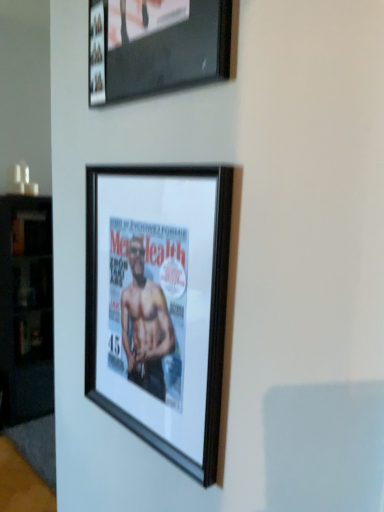
Describe the element at coordinates (156, 46) in the screenshot. Image resolution: width=384 pixels, height=512 pixels. I see `matte black picture frame at upper center, the second picture frame when ordered from bottom to top` at that location.

I want to click on black matte picture frame at center, which appears as the first picture frame when ordered from the bottom, so click(159, 304).

Which point is more distant from viewer, (159, 320) or (213, 59)?

Positioned behind is point (159, 320).

Between black matte picture frame at center, the 2th picture frame when ordered from top to bottom, and matte black picture frame at upper center, which appears as the first picture frame when viewed from the top, which one has smaller width?

With smaller width is black matte picture frame at center, the 2th picture frame when ordered from top to bottom.

Is black matte picture frame at center, the 2th picture frame when ordered from top to bottom, to the left or to the right of matte black picture frame at upper center, the second picture frame when ordered from bottom to top, in the image?

black matte picture frame at center, the 2th picture frame when ordered from top to bottom, is positioned on matte black picture frame at upper center, the second picture frame when ordered from bottom to top,'s left side.

Based on the photo, considering the sizes of black matte picture frame at center, the 2th picture frame when ordered from top to bottom, and matte black picture frame at upper center, the second picture frame when ordered from bottom to top, in the image, is black matte picture frame at center, the 2th picture frame when ordered from top to bottom, bigger or smaller than matte black picture frame at upper center, the second picture frame when ordered from bottom to top,?

black matte picture frame at center, the 2th picture frame when ordered from top to bottom, is smaller than matte black picture frame at upper center, the second picture frame when ordered from bottom to top.

Where is `cabinetry below the black matte picture frame at center, which appears as the first picture frame when ordered from the bottom (from the image's perspective)`? The height and width of the screenshot is (512, 384). cabinetry below the black matte picture frame at center, which appears as the first picture frame when ordered from the bottom (from the image's perspective) is located at coordinates (26, 308).

Which object is further away from the camera, black matte picture frame at center, which appears as the first picture frame when ordered from the bottom, or black wood cabinet at left?

Positioned behind is black wood cabinet at left.

Is black matte picture frame at center, the 2th picture frame when ordered from top to bottom, looking in the opposite direction of black wood cabinet at left?

No.

Considering the relative positions of black matte picture frame at center, which appears as the first picture frame when ordered from the bottom, and black wood cabinet at left in the image provided, is black matte picture frame at center, which appears as the first picture frame when ordered from the bottom, to the right of black wood cabinet at left from the viewer's perspective?

Yes, black matte picture frame at center, which appears as the first picture frame when ordered from the bottom, is to the right of black wood cabinet at left.

Based on the photo, which object is closer to the camera, matte black picture frame at upper center, the second picture frame when ordered from bottom to top, or black wood cabinet at left?

matte black picture frame at upper center, the second picture frame when ordered from bottom to top, is more forward.

Based on their positions, is matte black picture frame at upper center, the second picture frame when ordered from bottom to top, located to the left or right of black wood cabinet at left?

Clearly, matte black picture frame at upper center, the second picture frame when ordered from bottom to top, is on the right of black wood cabinet at left in the image.

Who is shorter, matte black picture frame at upper center, the second picture frame when ordered from bottom to top, or black wood cabinet at left?

matte black picture frame at upper center, the second picture frame when ordered from bottom to top, is shorter.

Considering the relative sizes of matte black picture frame at upper center, the second picture frame when ordered from bottom to top, and black wood cabinet at left in the image provided, is matte black picture frame at upper center, the second picture frame when ordered from bottom to top, wider than black wood cabinet at left?

In fact, matte black picture frame at upper center, the second picture frame when ordered from bottom to top, might be narrower than black wood cabinet at left.

Based on the photo, from a real-world perspective, is black wood cabinet at left located beneath black matte picture frame at center, which appears as the first picture frame when ordered from the bottom?

Yes.

Is the position of black wood cabinet at left less distant than that of black matte picture frame at center, the 2th picture frame when ordered from top to bottom?

No, it is not.

Considering the relative sizes of black wood cabinet at left and black matte picture frame at center, which appears as the first picture frame when ordered from the bottom, in the image provided, is black wood cabinet at left bigger than black matte picture frame at center, which appears as the first picture frame when ordered from the bottom,?

Indeed, black wood cabinet at left has a larger size compared to black matte picture frame at center, which appears as the first picture frame when ordered from the bottom.

Is black wood cabinet at left in contact with matte black picture frame at upper center, the second picture frame when ordered from bottom to top?

No, black wood cabinet at left is not touching matte black picture frame at upper center, the second picture frame when ordered from bottom to top.

From the image's perspective, which is above, black wood cabinet at left or matte black picture frame at upper center, the second picture frame when ordered from bottom to top?

matte black picture frame at upper center, the second picture frame when ordered from bottom to top, appears higher in the image.

Is black wood cabinet at left looking in the opposite direction of matte black picture frame at upper center, which appears as the first picture frame when viewed from the top?

No, black wood cabinet at left is not facing away from matte black picture frame at upper center, which appears as the first picture frame when viewed from the top.

Can you confirm if matte black picture frame at upper center, which appears as the first picture frame when viewed from the top, is shorter than black matte picture frame at center, the 2th picture frame when ordered from top to bottom?

Correct, matte black picture frame at upper center, which appears as the first picture frame when viewed from the top, is not as tall as black matte picture frame at center, the 2th picture frame when ordered from top to bottom.

Based on the photo, considering the relative sizes of matte black picture frame at upper center, which appears as the first picture frame when viewed from the top, and black matte picture frame at center, the 2th picture frame when ordered from top to bottom, in the image provided, is matte black picture frame at upper center, which appears as the first picture frame when viewed from the top, thinner than black matte picture frame at center, the 2th picture frame when ordered from top to bottom,?

No, matte black picture frame at upper center, which appears as the first picture frame when viewed from the top, is not thinner than black matte picture frame at center, the 2th picture frame when ordered from top to bottom.

Is matte black picture frame at upper center, the second picture frame when ordered from bottom to top, touching black matte picture frame at center, the 2th picture frame when ordered from top to bottom?

matte black picture frame at upper center, the second picture frame when ordered from bottom to top, and black matte picture frame at center, the 2th picture frame when ordered from top to bottom, are clearly separated.

Is matte black picture frame at upper center, which appears as the first picture frame when viewed from the top, facing away from black matte picture frame at center, the 2th picture frame when ordered from top to bottom?

No.

You are a GUI agent. You are given a task and a screenshot of the screen. Output one action in this format:
    pyautogui.click(x=<x>, y=<y>)
    Task: Click on the picture frame below the matte black picture frame at upper center, the second picture frame when ordered from bottom to top (from a real-world perspective)
    The height and width of the screenshot is (512, 384).
    Given the screenshot: What is the action you would take?
    pyautogui.click(x=159, y=304)

The height and width of the screenshot is (512, 384). I want to click on cabinetry below the black matte picture frame at center, which appears as the first picture frame when ordered from the bottom (from the image's perspective), so click(26, 308).

When comparing their distances from black matte picture frame at center, the 2th picture frame when ordered from top to bottom, does matte black picture frame at upper center, the second picture frame when ordered from bottom to top, or black wood cabinet at left seem further?

Based on the image, black wood cabinet at left appears to be further to black matte picture frame at center, the 2th picture frame when ordered from top to bottom.

Considering their positions, is black wood cabinet at left positioned further to matte black picture frame at upper center, which appears as the first picture frame when viewed from the top, than black matte picture frame at center, the 2th picture frame when ordered from top to bottom?

black wood cabinet at left is positioned further to the anchor matte black picture frame at upper center, which appears as the first picture frame when viewed from the top.

From the image, which object appears to be farther from black wood cabinet at left, matte black picture frame at upper center, which appears as the first picture frame when viewed from the top, or black matte picture frame at center, which appears as the first picture frame when ordered from the bottom?

matte black picture frame at upper center, which appears as the first picture frame when viewed from the top.

From the image, which object appears to be farther from black matte picture frame at center, the 2th picture frame when ordered from top to bottom, black wood cabinet at left or matte black picture frame at upper center, which appears as the first picture frame when viewed from the top?

The object further to black matte picture frame at center, the 2th picture frame when ordered from top to bottom, is black wood cabinet at left.

Based on their spatial positions, is black matte picture frame at center, the 2th picture frame when ordered from top to bottom, or matte black picture frame at upper center, the second picture frame when ordered from bottom to top, further from black wood cabinet at left?

The object further to black wood cabinet at left is matte black picture frame at upper center, the second picture frame when ordered from bottom to top.

Consider the image. Estimate the real-world distances between objects in this image. Which object is closer to matte black picture frame at upper center, which appears as the first picture frame when viewed from the top, black matte picture frame at center, which appears as the first picture frame when ordered from the bottom, or black wood cabinet at left?

black matte picture frame at center, which appears as the first picture frame when ordered from the bottom, is closer to matte black picture frame at upper center, which appears as the first picture frame when viewed from the top.

Where is `picture frame between matte black picture frame at upper center, the second picture frame when ordered from bottom to top, and black wood cabinet at left in the front-back direction`? The width and height of the screenshot is (384, 512). picture frame between matte black picture frame at upper center, the second picture frame when ordered from bottom to top, and black wood cabinet at left in the front-back direction is located at coordinates (159, 304).